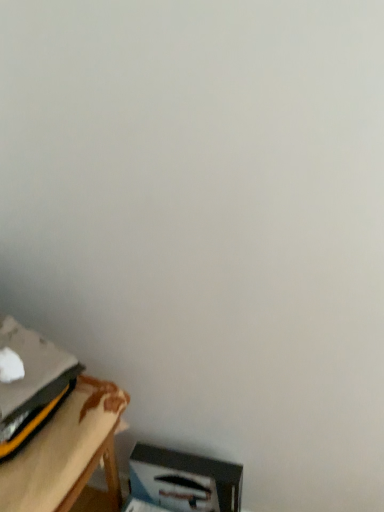
The image size is (384, 512). Find the location of `wooden table at lower left`. wooden table at lower left is located at coordinates (67, 452).

In the scene shown: What is the approximate height of wooden table at lower left?

9.47 inches.

The image size is (384, 512). What do you see at coordinates (67, 452) in the screenshot?
I see `wooden table at lower left` at bounding box center [67, 452].

Locate an element on the screen. The width and height of the screenshot is (384, 512). white cardboard box at lower right is located at coordinates (184, 480).

Measure the distance between point [236,484] and camera.

Point [236,484] is 1.28 meters away from camera.

Describe the element at coordinates (184, 480) in the screenshot. I see `white cardboard box at lower right` at that location.

The height and width of the screenshot is (512, 384). Find the location of `wooden table at lower left`. wooden table at lower left is located at coordinates (67, 452).

Which is more to the left, wooden table at lower left or white cardboard box at lower right?

Positioned to the left is wooden table at lower left.

Which object is further away from the camera taking this photo, wooden table at lower left or white cardboard box at lower right?

Positioned behind is white cardboard box at lower right.

Is point (76, 480) positioned behind point (174, 497)?

No, (76, 480) is in front of (174, 497).

From the image's perspective, would you say wooden table at lower left is shown under white cardboard box at lower right?

Actually, wooden table at lower left appears above white cardboard box at lower right in the image.

From a real-world perspective, is wooden table at lower left positioned above or below white cardboard box at lower right?

wooden table at lower left is above white cardboard box at lower right.

Considering the sizes of objects wooden table at lower left and white cardboard box at lower right in the image provided, who is wider, wooden table at lower left or white cardboard box at lower right?

wooden table at lower left.

Is wooden table at lower left taller than white cardboard box at lower right?

In fact, wooden table at lower left may be shorter than white cardboard box at lower right.

Does wooden table at lower left have a smaller size compared to white cardboard box at lower right?

Actually, wooden table at lower left might be larger than white cardboard box at lower right.

Is white cardboard box at lower right surrounded by wooden table at lower left?

No, white cardboard box at lower right is located outside of wooden table at lower left.

Are wooden table at lower left and white cardboard box at lower right located far from each other?

No, wooden table at lower left is in close proximity to white cardboard box at lower right.

Is white cardboard box at lower right at the back of wooden table at lower left?

No, wooden table at lower left is not facing the opposite direction of white cardboard box at lower right.

How many degrees apart are the facing directions of wooden table at lower left and white cardboard box at lower right?

There is a 83-degree angle between the facing directions of wooden table at lower left and white cardboard box at lower right.

Locate an element on the screen. The width and height of the screenshot is (384, 512). table on the left of the white cardboard box at lower right is located at coordinates (67, 452).

Between white cardboard box at lower right and wooden table at lower left, which one appears on the right side from the viewer's perspective?

white cardboard box at lower right is more to the right.

Considering their positions, is white cardboard box at lower right located in front of or behind wooden table at lower left?

In the image, white cardboard box at lower right appears behind wooden table at lower left.

Which is in front, point (185, 508) or point (40, 509)?

Point (40, 509)

Consider the image. From the image's perspective, would you say white cardboard box at lower right is shown under wooden table at lower left?

Correct, white cardboard box at lower right appears lower than wooden table at lower left in the image.

From a real-world perspective, relative to wooden table at lower left, is white cardboard box at lower right vertically above or below?

From a real-world perspective, white cardboard box at lower right is physically below wooden table at lower left.

Can you confirm if white cardboard box at lower right is thinner than wooden table at lower left?

Indeed, white cardboard box at lower right has a lesser width compared to wooden table at lower left.

In terms of height, does white cardboard box at lower right look taller or shorter compared to wooden table at lower left?

In the image, white cardboard box at lower right appears to be taller than wooden table at lower left.

Which of these two, white cardboard box at lower right or wooden table at lower left, is bigger?

wooden table at lower left is bigger.

Does white cardboard box at lower right contain wooden table at lower left?

No, white cardboard box at lower right does not contain wooden table at lower left.

Based on the photo, is there a large distance between white cardboard box at lower right and wooden table at lower left?

white cardboard box at lower right is actually quite close to wooden table at lower left.

Is white cardboard box at lower right oriented towards wooden table at lower left?

No, white cardboard box at lower right is not aimed at wooden table at lower left.

What's the angular difference between white cardboard box at lower right and wooden table at lower left's facing directions?

The facing directions of white cardboard box at lower right and wooden table at lower left are 83 degrees apart.

This screenshot has width=384, height=512. Identify the location of table above the white cardboard box at lower right (from the image's perspective). (67, 452).

The image size is (384, 512). I want to click on cardboard box directly beneath the wooden table at lower left (from a real-world perspective), so click(x=184, y=480).

The height and width of the screenshot is (512, 384). In the image, there is a white cardboard box at lower right. What are the coordinates of `table above it (from the image's perspective)` in the screenshot? It's located at (67, 452).